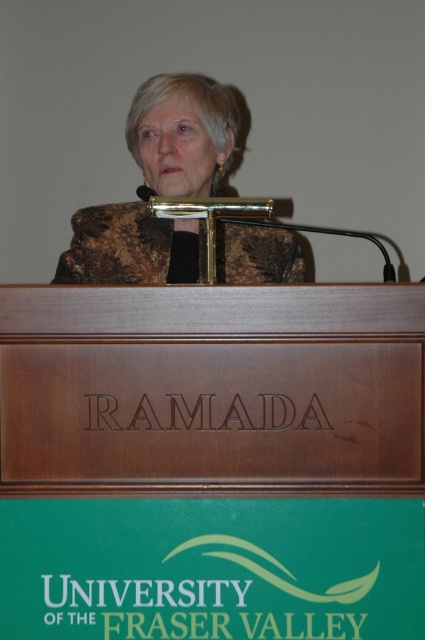
Is brown polished wood podium at center to the left of brown textured jacket at center from the viewer's perspective?

No, brown polished wood podium at center is not to the left of brown textured jacket at center.

Which is in front, point (170, 474) or point (163, 90)?

Point (170, 474)

This screenshot has width=425, height=640. I want to click on brown polished wood podium at center, so click(x=212, y=392).